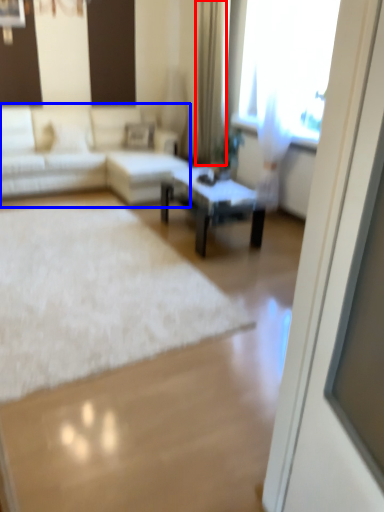
Question: Which object appears closest to the camera in this image, curtain (highlighted by a red box) or studio couch (highlighted by a blue box)?

Choices:
 (A) curtain
 (B) studio couch

Answer: (B)